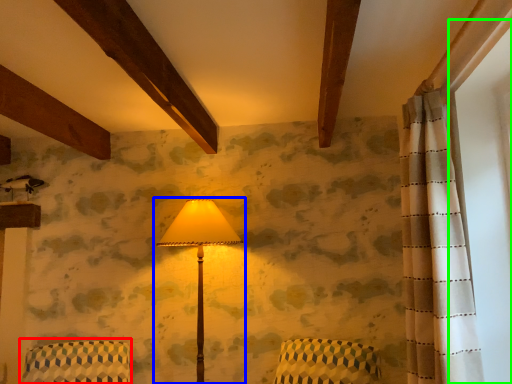
Question: Which object is positioned farthest from armchair (highlighted by a red box)? Select from lamp (highlighted by a blue box) and window screen (highlighted by a green box).

Choices:
 (A) lamp
 (B) window screen

Answer: (B)